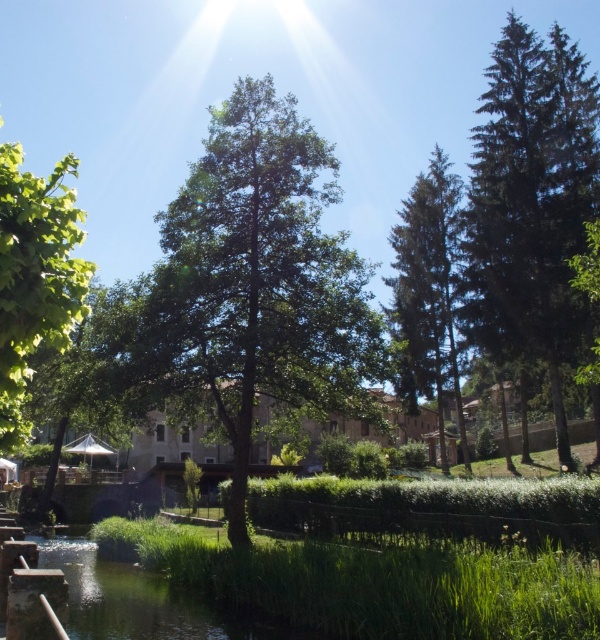
You are standing at the center of the image and see the dark green coniferous tree at right and the green leafy tree at left. Which tree is positioned to the right side of the other?

The dark green coniferous tree at right is positioned to the right of the green leafy tree at left.

You are a landscape architect designing a garden path that must pass between the green leafy tree at center and the dark green coniferous tree at right. The path needs to be at least 2 meters wide to accommodate a wheelbarrow. Can the path fit between them?

The green leafy tree at center is narrower than the dark green coniferous tree at right, but the description only states their widths relative to each other. Without specific measurements, we cannot confirm if the space between them is at least 2 meters wide. Additional information is needed.